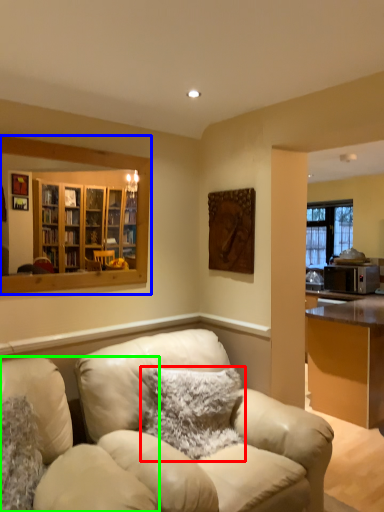
Question: Which object is the farthest from pillow (highlighted by a red box)? Choose among these: mirror (highlighted by a blue box) or chair (highlighted by a green box).

Choices:
 (A) mirror
 (B) chair

Answer: (A)